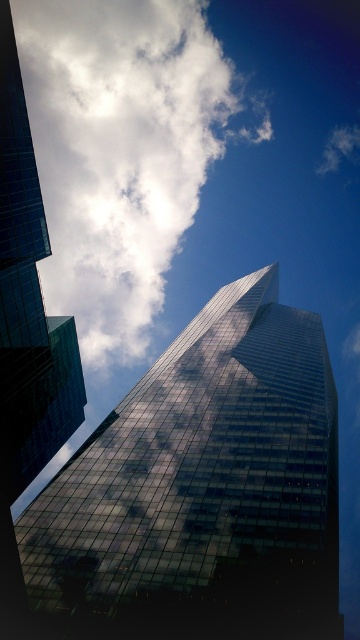
You are standing at point 0.5,0.5 in the image coordinate system. You want to take a photo of the reflective glass skyscraper at center. In which direction should you move to get the skyscraper centered in your camera view?

Since the reflective glass skyscraper at center is located at point (204, 484) and you are at (180, 320), you should move to the right and slightly upward to center it in your camera view.

You are standing on the ground looking up at the glassy reflective skyscraper at left and the white fluffy cloud at upper center. Which object appears taller in the sky?

The white fluffy cloud at upper center has a greater height compared to the glassy reflective skyscraper at left, so it appears taller in the sky.

You are standing on the ground looking up at the modern glass skyscraper. A point labeled as point (204,484) is marked on the image. Based on the description, where is this point located on the skyscraper?

The point (204,484) marks the reflective glass skyscraper at center.